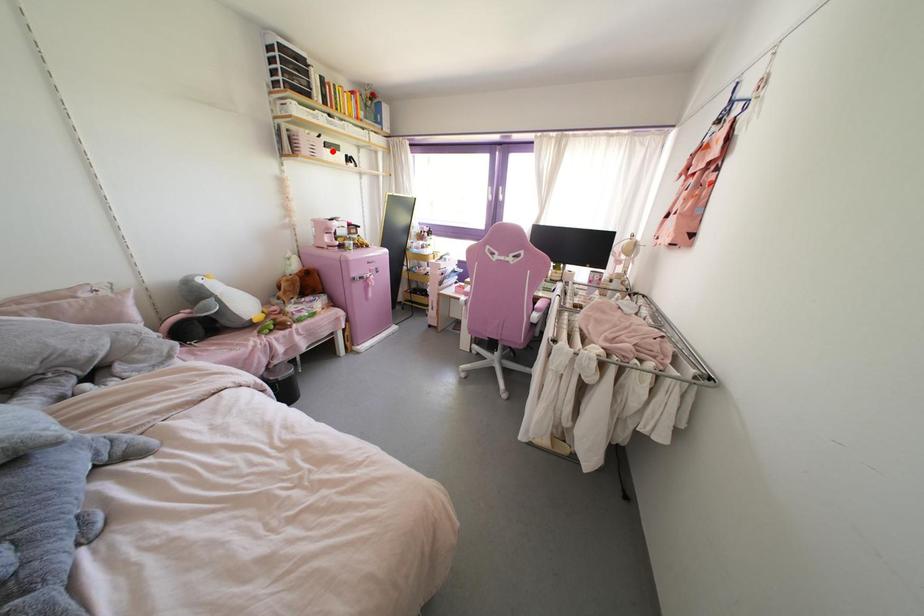
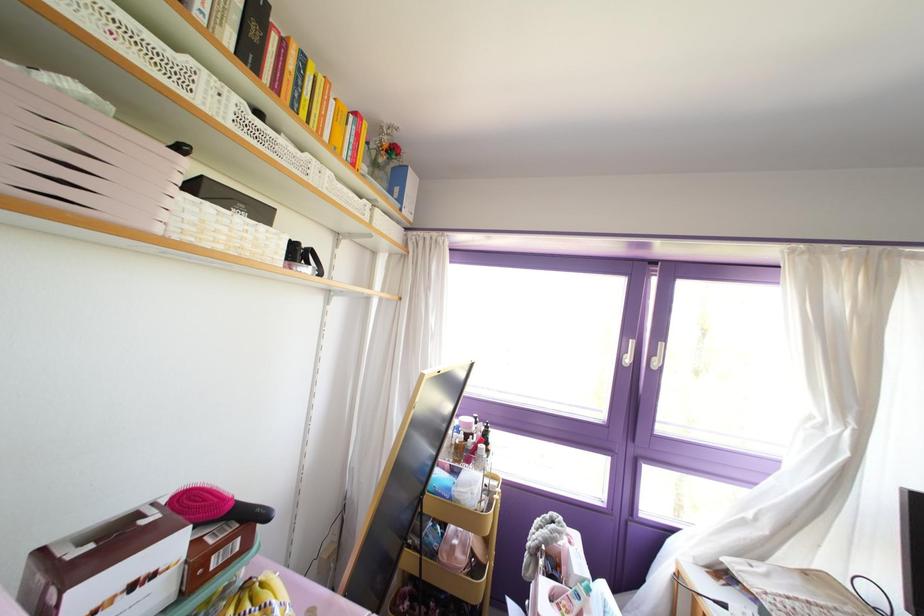
Where in the second image is the point corresponding to the highlighted location from the first image?

(237, 219)